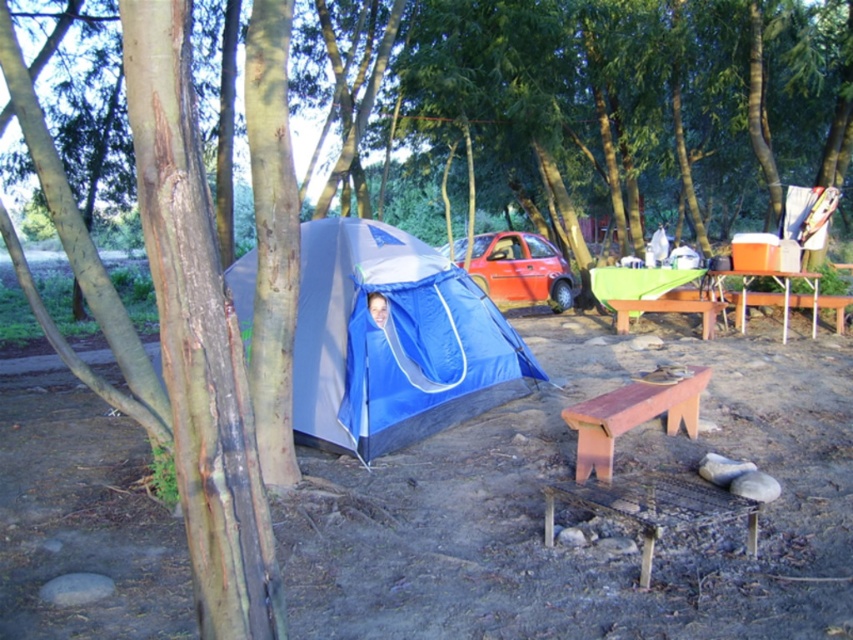
Does matte red car at center have a larger size compared to orange plastic picnic table at right?

Correct, matte red car at center is larger in size than orange plastic picnic table at right.

This screenshot has height=640, width=853. I want to click on matte red car at center, so click(x=521, y=269).

At what (x,y) coordinates should I click in order to perform the action: click on matte red car at center. Please return your answer as a coordinate pair (x, y). This screenshot has height=640, width=853. Looking at the image, I should click on point(521,269).

Who is lower down, blue tarpaulin tent at center or brown wooden bench at lower center?

brown wooden bench at lower center is below.

The width and height of the screenshot is (853, 640). What do you see at coordinates (393, 340) in the screenshot?
I see `blue tarpaulin tent at center` at bounding box center [393, 340].

What are the coordinates of `blue tarpaulin tent at center` in the screenshot? It's located at (393, 340).

Is blue tarpaulin tent at center behind orange plastic picnic table at right?

No.

Is point (468, 307) behind point (720, 294)?

No.

Who is more forward, (349, 388) or (786, 323)?

Point (349, 388) is more forward.

You are a GUI agent. You are given a task and a screenshot of the screen. Output one action in this format:
    pyautogui.click(x=<x>, y=<y>)
    Task: Click on the blue tarpaulin tent at center
    This screenshot has height=640, width=853.
    Given the screenshot: What is the action you would take?
    pyautogui.click(x=393, y=340)